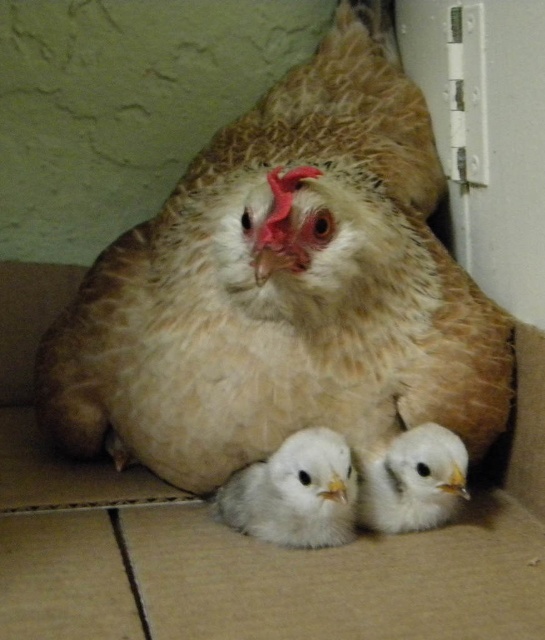
Question: Does brown cardboard box at center have a greater width compared to white fluffy chick at center?

Choices:
 (A) no
 (B) yes

Answer: (B)

Question: Which of the following is the farthest from the observer?

Choices:
 (A) (382, 472)
 (B) (269, 481)
 (C) (208, 364)

Answer: (A)

Question: Does brown textured chicken at center appear under white fluffy chick at center?

Choices:
 (A) yes
 (B) no

Answer: (B)

Question: Does brown cardboard box at center appear on the right side of white fluffy chick at center?

Choices:
 (A) yes
 (B) no

Answer: (B)

Question: Which is farther from the brown textured chicken at center?

Choices:
 (A) brown cardboard box at center
 (B) white fluffy chick at lower center

Answer: (B)

Question: Which of the following is the farthest from the observer?

Choices:
 (A) (89, 483)
 (B) (390, 260)
 (C) (458, 492)

Answer: (A)